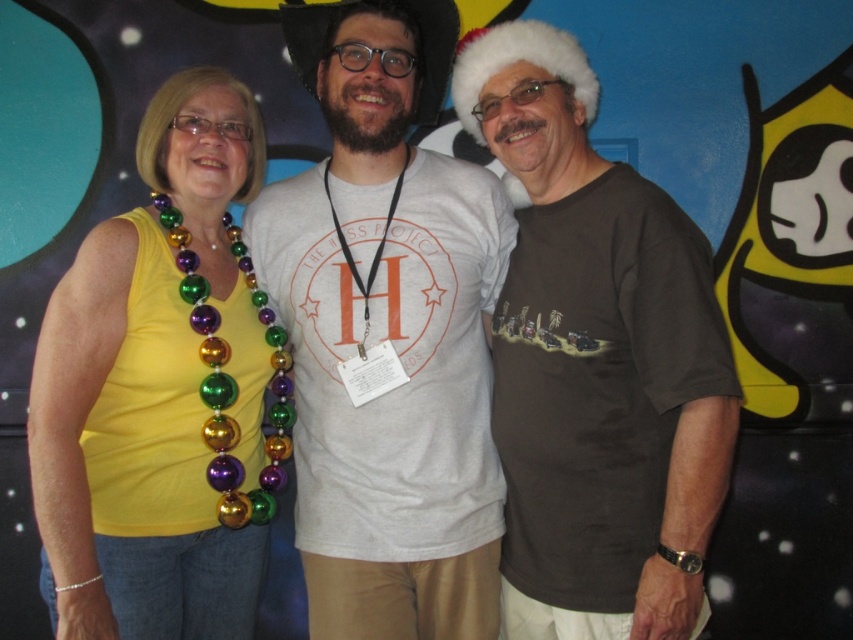
Is white cotton t-shirt at center smaller than brown matte shirt at right?

No.

Does point (343, 438) come closer to viewer compared to point (479, 77)?

No, it is not.

Between point (343, 630) and point (704, 385), which one is positioned behind?

Point (343, 630)

You are a GUI agent. You are given a task and a screenshot of the screen. Output one action in this format:
    pyautogui.click(x=<x>, y=<y>)
    Task: Click on the white cotton t-shirt at center
    This screenshot has width=853, height=640.
    Given the screenshot: What is the action you would take?
    pyautogui.click(x=387, y=333)

Consider the image. Can you confirm if brown matte shirt at right is thinner than yellow fabric tank top at left?

In fact, brown matte shirt at right might be wider than yellow fabric tank top at left.

This screenshot has height=640, width=853. I want to click on brown matte shirt at right, so click(595, 362).

What are the coordinates of `brown matte shirt at right` in the screenshot? It's located at (595, 362).

Does white cotton t-shirt at center have a lesser height compared to yellow fabric tank top at left?

No.

Does point (395, 4) come farther from viewer compared to point (215, 554)?

No, (395, 4) is in front of (215, 554).

Is point (305, 19) closer to camera compared to point (195, 572)?

No, (305, 19) is further to viewer.

Locate an element on the screen. white cotton t-shirt at center is located at coordinates (387, 333).